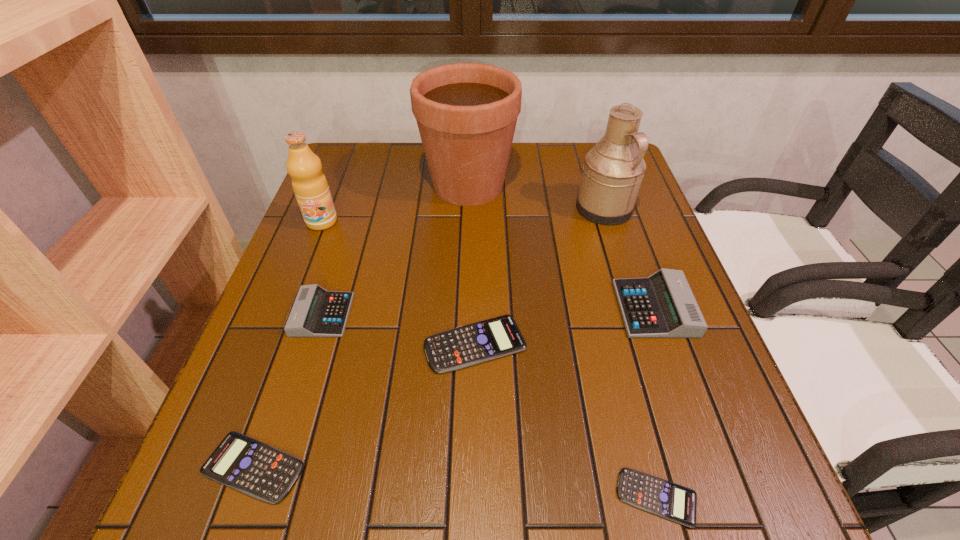
I want to click on flowerpot, so click(466, 113).

Locate an element on the screen. The width and height of the screenshot is (960, 540). pitcher is located at coordinates (613, 170).

Where is `fruit juice`? Image resolution: width=960 pixels, height=540 pixels. fruit juice is located at coordinates (309, 183).

Find the location of a particular element. The width and height of the screenshot is (960, 540). the right gray calculator is located at coordinates (662, 305).

At what (x,y) coordinates should I click in order to perform the action: click on the fourth tallest object. Please return your answer as a coordinate pair (x, y). This screenshot has width=960, height=540. Looking at the image, I should click on (662, 305).

Identify the location of the left gray calculator. [316, 312].

The height and width of the screenshot is (540, 960). What are the coordinates of `the fourth shortest calculator` in the screenshot? It's located at (316, 312).

You are a GUI agent. You are given a task and a screenshot of the screen. Output one action in this format:
    pyautogui.click(x=<x>, y=<y>)
    Task: Click on the third calculator from right to left
    
    Given the screenshot: What is the action you would take?
    pyautogui.click(x=472, y=344)

This screenshot has height=540, width=960. In order to click on the sixth tallest object in this screenshot , I will do `click(472, 344)`.

Where is `the second biggest blue calculator`? Image resolution: width=960 pixels, height=540 pixels. the second biggest blue calculator is located at coordinates click(x=259, y=470).